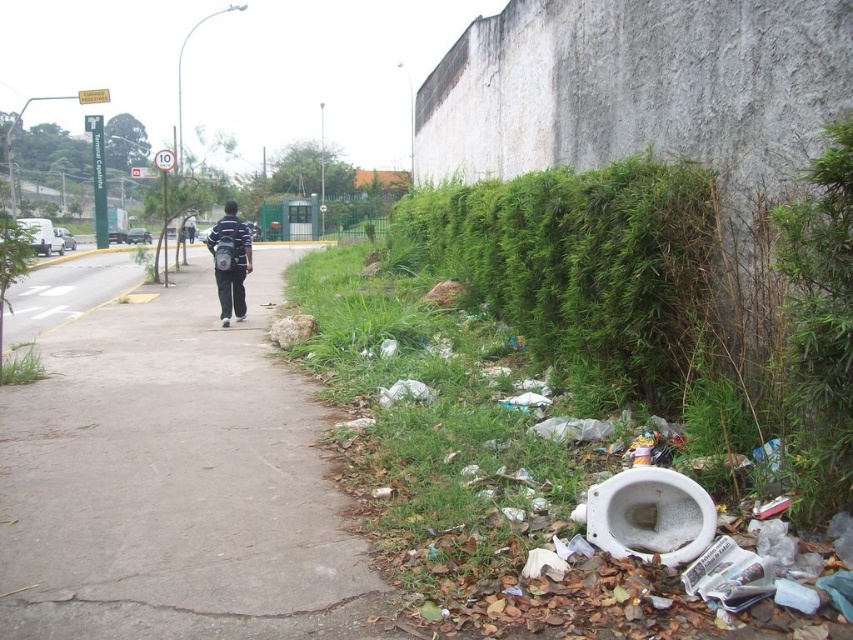
You are a delivery person who needs to cross the gray concrete sidewalk at center to reach the green leafy hedge at right. Considering their lengths, will you be able to walk the entire length of the sidewalk before reaching the hedge?

The gray concrete sidewalk at center is shorter than the green leafy hedge at right, so you will reach the hedge before walking the entire length of the sidewalk.

You are a delivery person who needs to place a package on the gray concrete sidewalk at center. However, there is a black fabric backpack at center in the way. Can you move the backpack to the side to make space for the package?

The gray concrete sidewalk at center is larger in size than the black fabric backpack at center, so moving the backpack to the side would free up enough space on the gray concrete sidewalk at center to place the package.